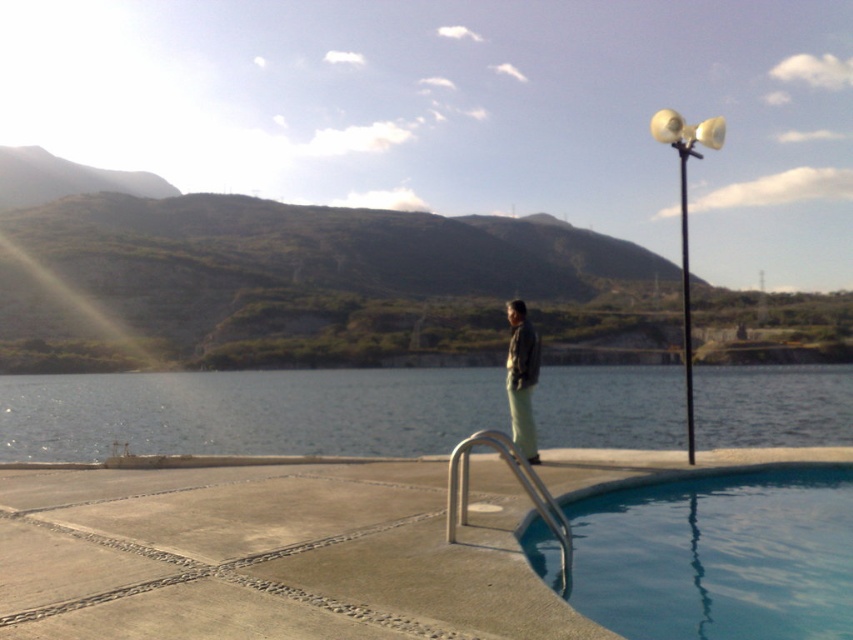
Question: Is silver metallic rail at lower center in front of matte black jacket at center?

Choices:
 (A) no
 (B) yes

Answer: (B)

Question: Among these objects, which one is farthest from the camera?

Choices:
 (A) matte black jacket at center
 (B) clear water at pool right
 (C) blue smooth water at lower right

Answer: (B)

Question: Is blue smooth water at lower right to the right of matte black jacket at center from the viewer's perspective?

Choices:
 (A) yes
 (B) no

Answer: (A)

Question: Does clear water at pool right appear under silver metallic rail at lower center?

Choices:
 (A) yes
 (B) no

Answer: (A)

Question: Which object is farther from the camera taking this photo?

Choices:
 (A) matte black jacket at center
 (B) clear water at pool right
 (C) silver metallic rail at lower center
 (D) blue smooth water at lower right

Answer: (B)

Question: Which point is closer to the camera?

Choices:
 (A) silver metallic rail at lower center
 (B) clear water at pool right

Answer: (A)